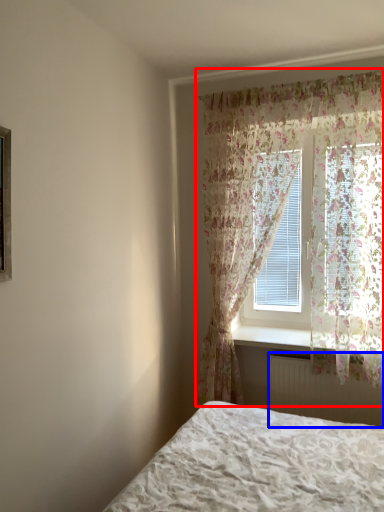
Question: Among these objects, which one is farthest to the camera, curtain (highlighted by a red box) or radiator (highlighted by a blue box)?

Choices:
 (A) curtain
 (B) radiator

Answer: (B)